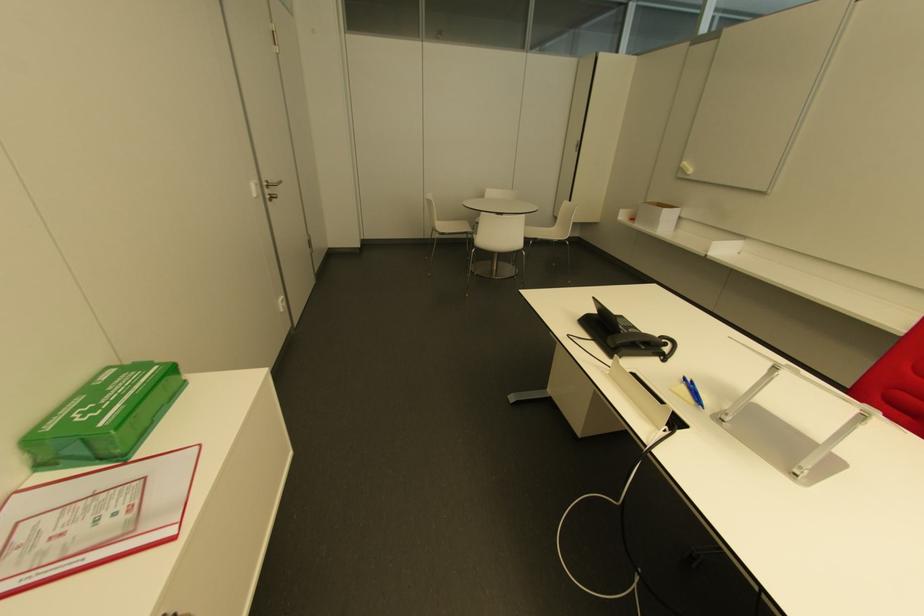
Describe the element at coordinates (103, 416) in the screenshot. I see `a small cardboard box` at that location.